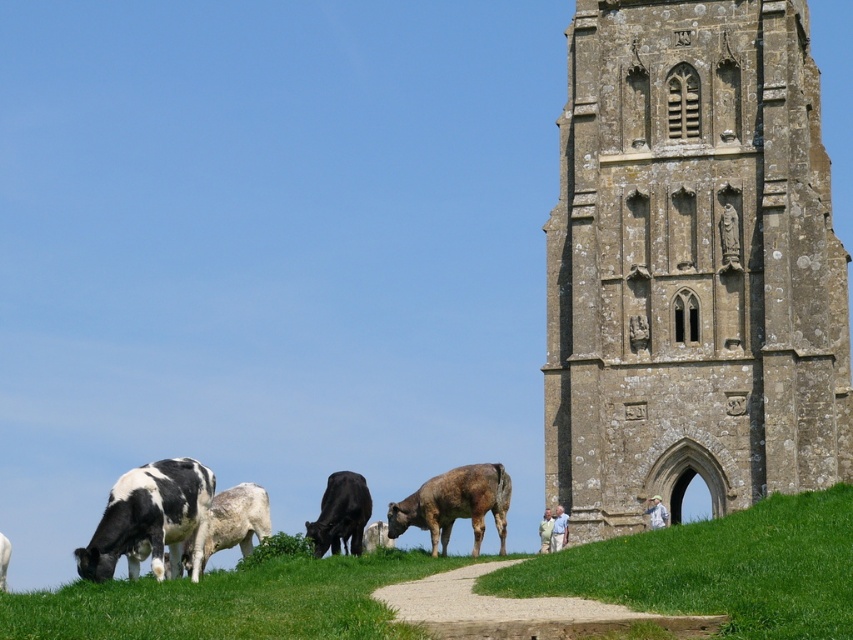
Question: Is green grass at lower right further to the viewer compared to white and black cow at lower left?

Choices:
 (A) yes
 (B) no

Answer: (B)

Question: Observing the image, what is the correct spatial positioning of green grass at lower right in reference to brown rough cow at lower center?

Choices:
 (A) below
 (B) above

Answer: (B)

Question: Is brown rough cow at lower center wider than brown textured cow at lower center?

Choices:
 (A) yes
 (B) no

Answer: (A)

Question: Among these points, which one is farthest from the camera?

Choices:
 (A) (346, 474)
 (B) (666, 429)

Answer: (A)

Question: Considering the real-world distances, which object is farthest from the black smooth cow at center?

Choices:
 (A) white and black cow at lower left
 (B) green grassy at lower left

Answer: (A)

Question: Which object is positioned farthest from the green grass at lower right?

Choices:
 (A) brown rough cow at lower center
 (B) black smooth cow at center
 (C) brown textured cow at lower center
 (D) brown stone tower at right

Answer: (B)